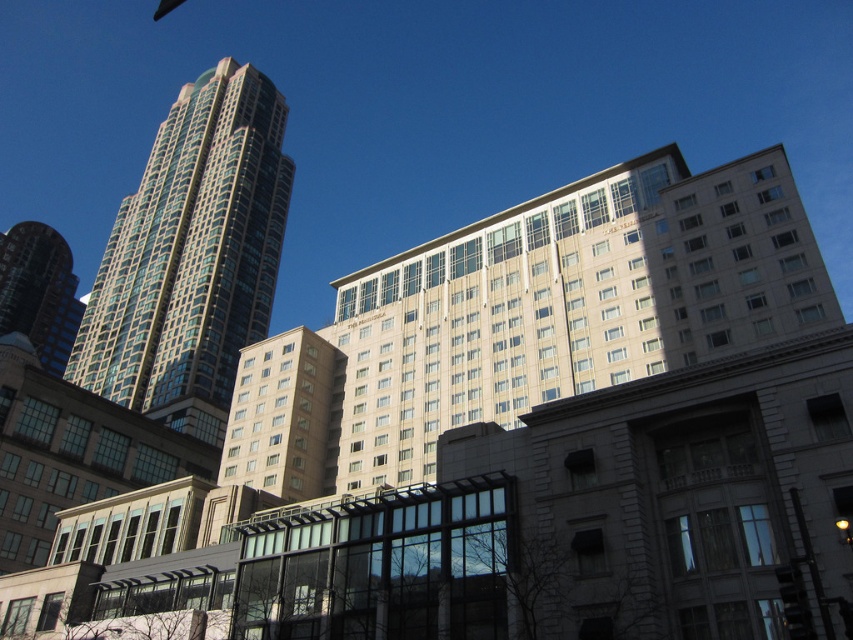
Question: Is glassy teal skyscraper at upper left above shiny glass skyscraper at left?

Choices:
 (A) no
 (B) yes

Answer: (B)

Question: Which object is closer to the camera taking this photo?

Choices:
 (A) glassy teal skyscraper at upper left
 (B) shiny glass skyscraper at left

Answer: (A)

Question: Does glassy teal skyscraper at upper left have a smaller size compared to shiny glass skyscraper at left?

Choices:
 (A) yes
 (B) no

Answer: (B)

Question: Where is glassy teal skyscraper at upper left located in relation to shiny glass skyscraper at left in the image?

Choices:
 (A) right
 (B) left

Answer: (A)

Question: Which point is closer to the camera?

Choices:
 (A) (256, 154)
 (B) (70, 330)

Answer: (A)